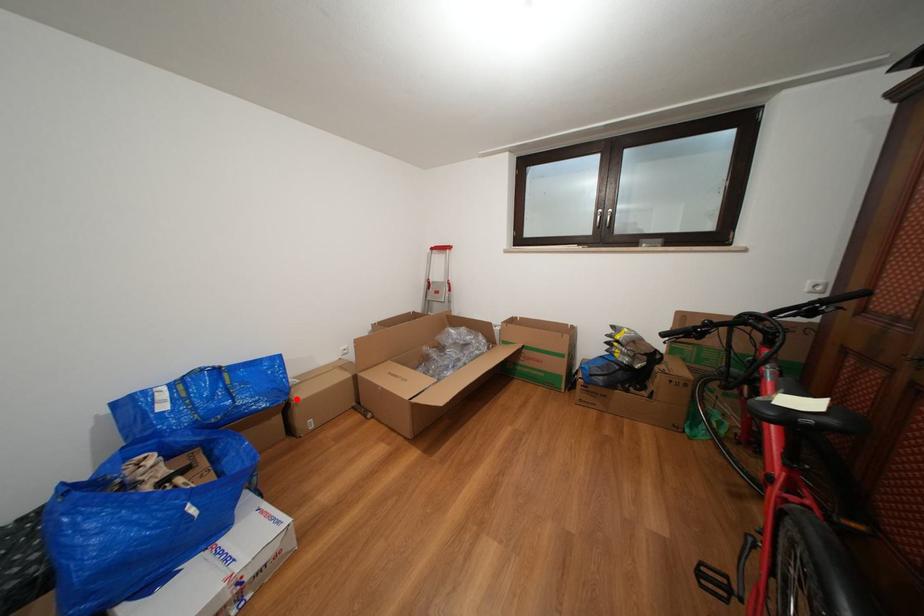
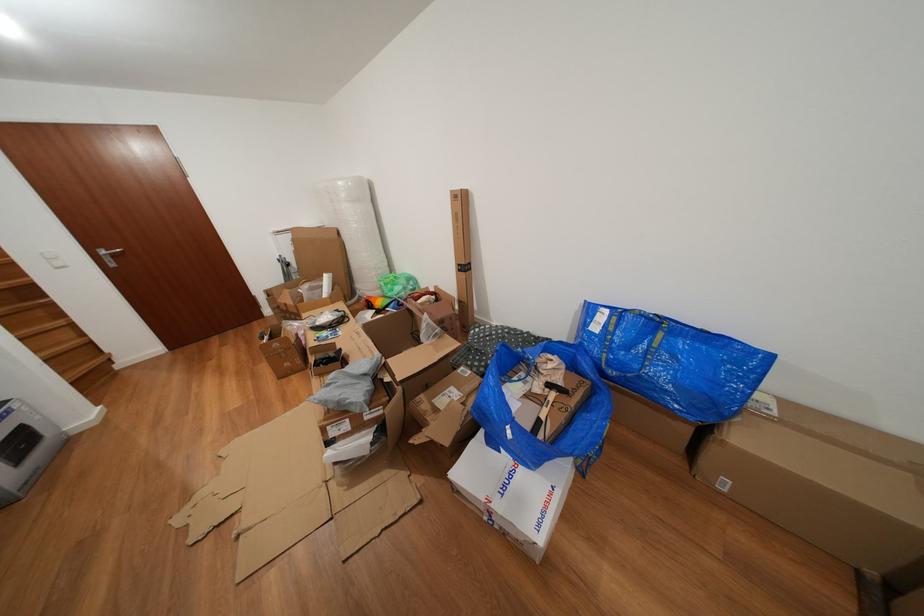
Where in the second image is the point corresponding to the highlighted location from the first image?

(734, 424)